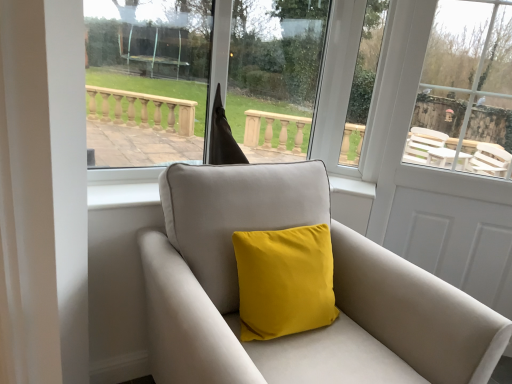
This screenshot has height=384, width=512. What do you see at coordinates (334, 291) in the screenshot?
I see `suede beige armchair at center` at bounding box center [334, 291].

Identify the location of suede beige armchair at center. This screenshot has height=384, width=512. (334, 291).

Find the location of a particular element. Image resolution: width=512 pixels, height=384 pixels. suede beige armchair at center is located at coordinates (334, 291).